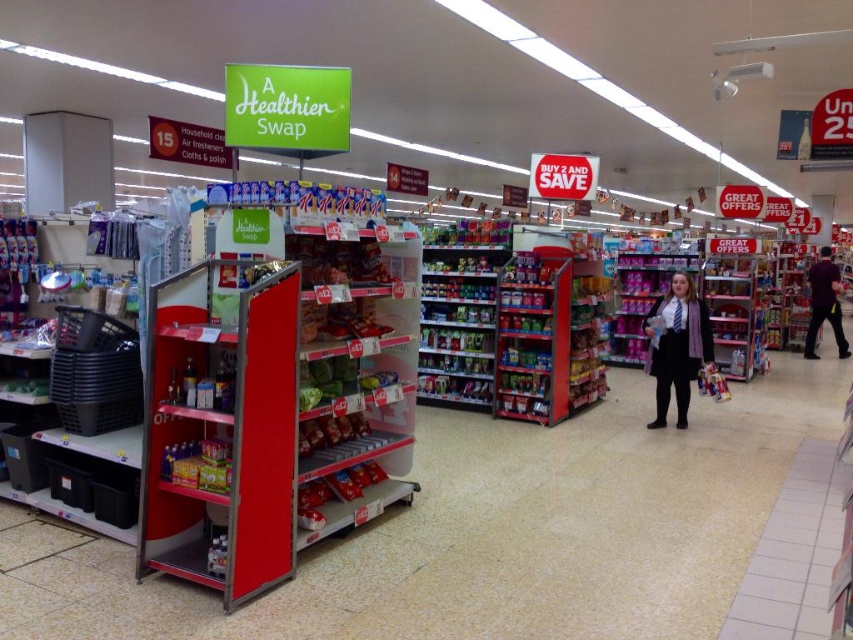
Question: Is metallic red shelf at center wider than purple fabric shirt at right?

Choices:
 (A) no
 (B) yes

Answer: (A)

Question: Considering the real-world distances, which object is farthest from the metallic red shelf at center?

Choices:
 (A) matte black blazer at center
 (B) red plastic shelf at center

Answer: (A)

Question: Among these objects, which one is farthest from the camera?

Choices:
 (A) metallic red shelf at center
 (B) red plastic shelf at center
 (C) matte black blazer at center

Answer: (C)

Question: Considering the relative positions of matte black blazer at center and purple fabric shirt at right in the image provided, where is matte black blazer at center located with respect to purple fabric shirt at right?

Choices:
 (A) right
 (B) left

Answer: (B)

Question: Is metallic red shelf at center smaller than matte black blazer at center?

Choices:
 (A) no
 (B) yes

Answer: (A)

Question: Based on their relative distances, which object is farther from the purple fabric shirt at right?

Choices:
 (A) matte black blazer at center
 (B) red plastic shelf at center

Answer: (B)